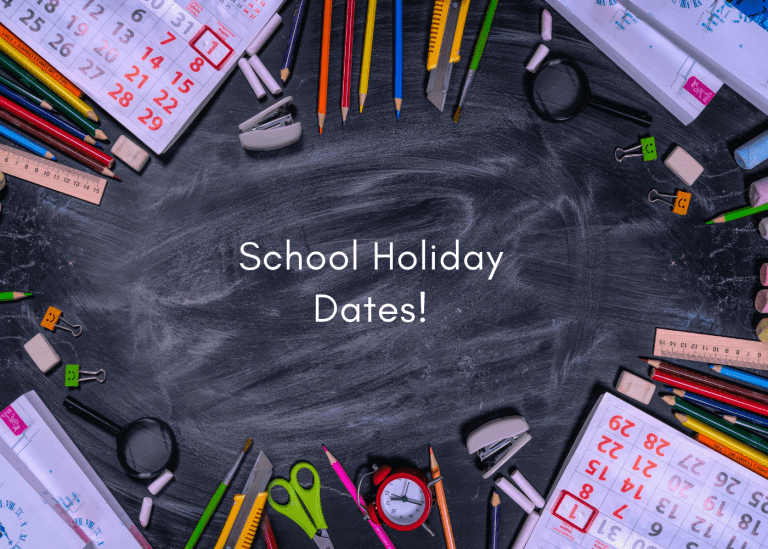
Where is `stapler`? stapler is located at coordinates (262, 122).